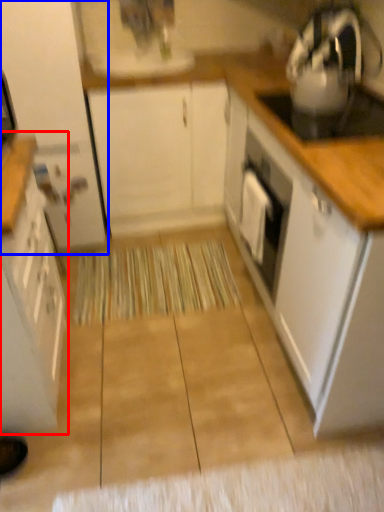
Question: Which of the following is the farthest to the observer, cabinetry (highlighted by a red box) or cabinetry (highlighted by a blue box)?

Choices:
 (A) cabinetry
 (B) cabinetry

Answer: (B)